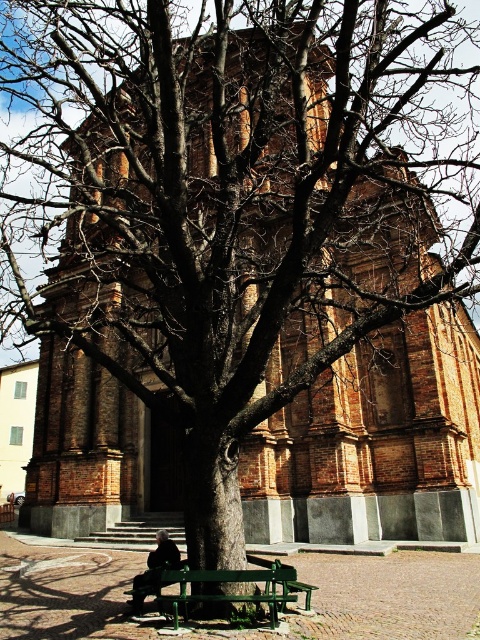
Is green painted wood bench at lower center closer to camera compared to dark gray fabric coat at lower center?

Yes, it is in front of dark gray fabric coat at lower center.

Describe the element at coordinates (225, 582) in the screenshot. I see `green painted wood bench at lower center` at that location.

Find the location of `green painted wood bench at lower center`. green painted wood bench at lower center is located at coordinates (225, 582).